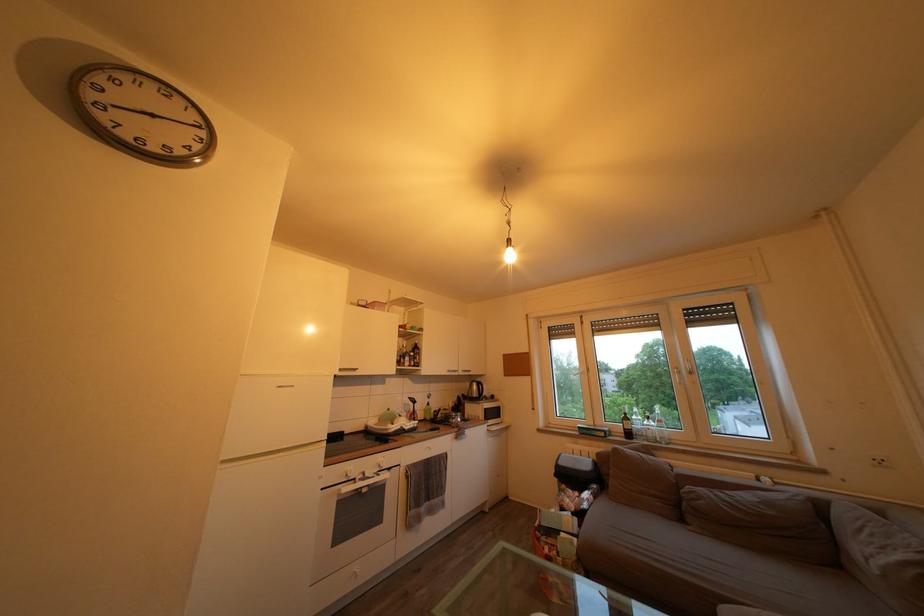
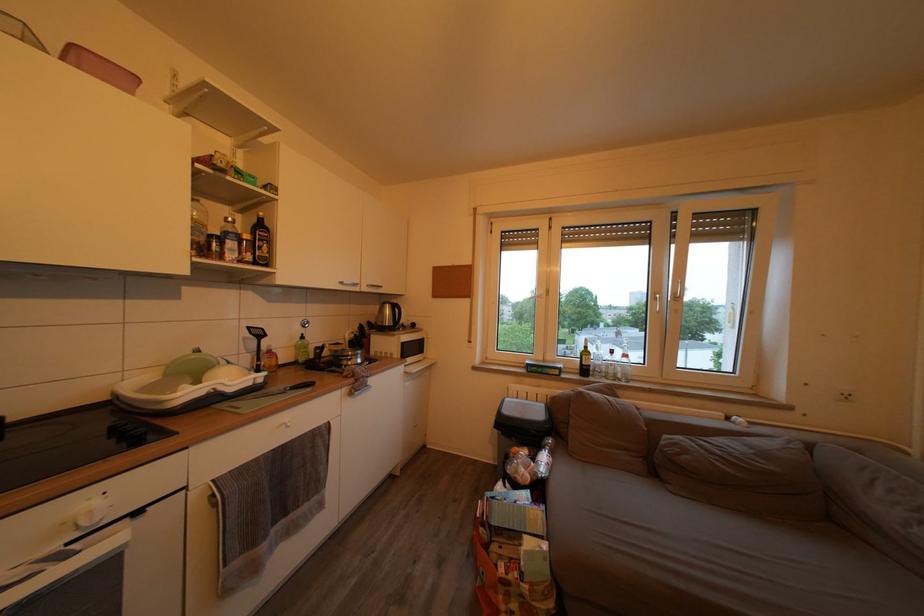
Where in the second image is the point corresponding to point (415, 435) from the first image?

(238, 397)